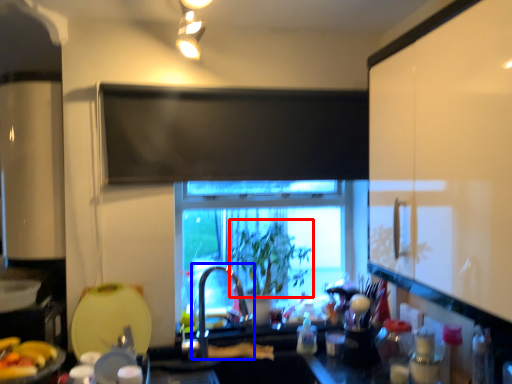
Question: Which object is closer to the camera taking this photo, plant (highlighted by a red box) or faucet (highlighted by a blue box)?

Choices:
 (A) plant
 (B) faucet

Answer: (B)